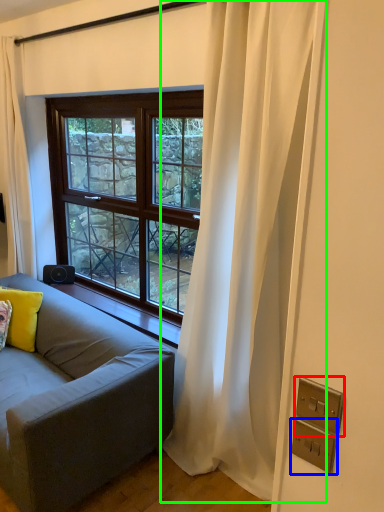
Question: Based on their relative distances, which object is farther from electric outlet (highlighted by a red box)? Choose from electric outlet (highlighted by a blue box) and curtain (highlighted by a green box).

Choices:
 (A) electric outlet
 (B) curtain

Answer: (B)